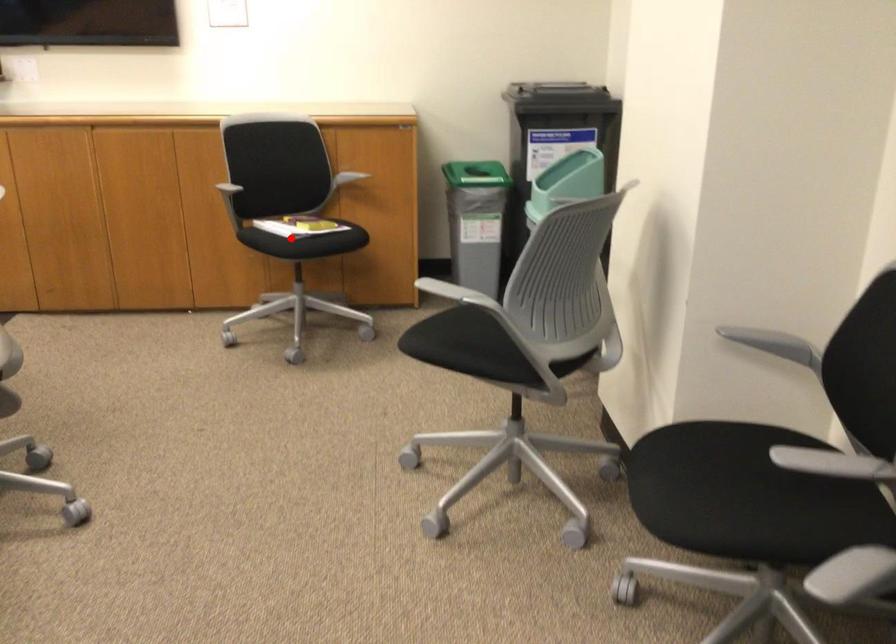
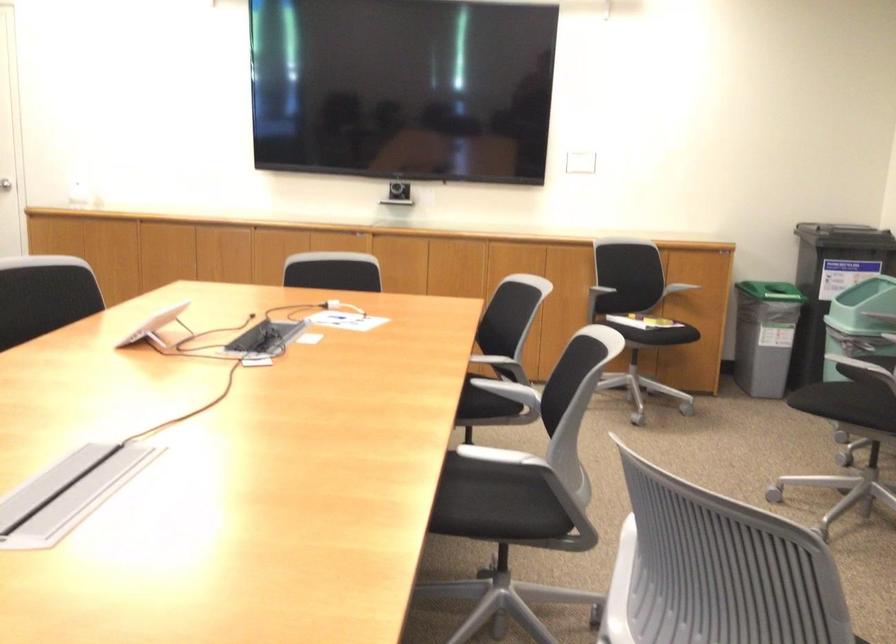
Question: I am providing you with two images of the same scene from different viewpoints. A red point is shown in image1. For the corresponding object point in image2, is it positioned nearer or farther from the camera?

Choices:
 (A) Nearer
 (B) Farther

Answer: (B)